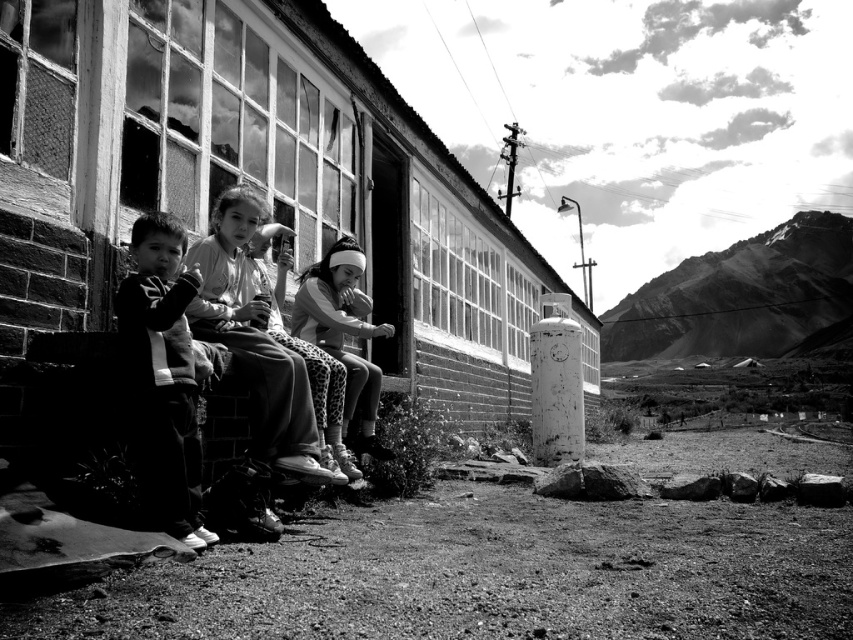
Based on the photo, you are standing in front of the building and see the point at coordinates [163,372]. What object or feature does this point correspond to?

The point at coordinates [163,372] corresponds to dark clothing at left.

You are a photographer trying to capture a closeup of the white fabric headband at center. You are currently focused on the dark clothing at left. Which direction should you move your camera to adjust your focus to the headband?

The dark clothing at left is positioned on the left side of the white fabric headband at center, so you should move your camera to the right to adjust focus to the headband.